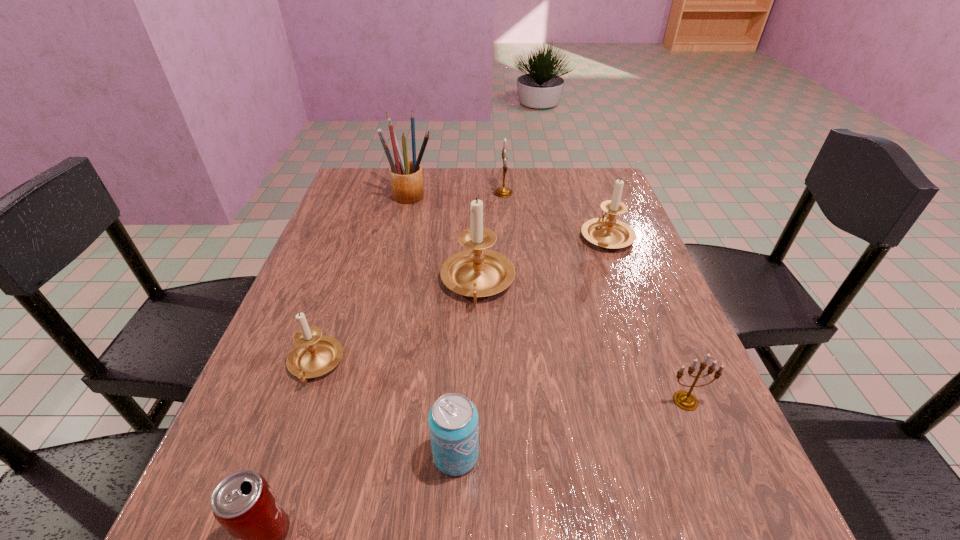
Where is `free space located on the left of the nearer gold candelabrum`? The height and width of the screenshot is (540, 960). free space located on the left of the nearer gold candelabrum is located at coordinates (479, 401).

Where is `vacant space located 0.100m on the right of the farther beer can`? vacant space located 0.100m on the right of the farther beer can is located at coordinates (543, 455).

This screenshot has width=960, height=540. I want to click on pencil box that is at the far edge, so click(x=406, y=177).

Where is `candelabrum positioned at the far edge`? candelabrum positioned at the far edge is located at coordinates (503, 192).

You are a GUI agent. You are given a task and a screenshot of the screen. Output one action in this format:
    pyautogui.click(x=<x>, y=<y>)
    Task: Click on the pencil box present at the left edge
    
    Given the screenshot: What is the action you would take?
    pyautogui.click(x=406, y=177)

Where is `candle holder that is at the left edge`? Image resolution: width=960 pixels, height=540 pixels. candle holder that is at the left edge is located at coordinates [314, 355].

This screenshot has height=540, width=960. Identify the location of object present at the far left corner. [x=406, y=177].

At what (x,y) coordinates should I click in order to perform the action: click on free spot at the far edge of the desktop. Please return your answer as a coordinate pair (x, y). The height and width of the screenshot is (540, 960). Looking at the image, I should click on (550, 170).

You are a GUI agent. You are given a task and a screenshot of the screen. Output one action in this format:
    pyautogui.click(x=<x>, y=<y>)
    Task: Click on the free region at the left edge of the desktop
    The height and width of the screenshot is (540, 960).
    Given the screenshot: What is the action you would take?
    pyautogui.click(x=237, y=470)

In the image, there is a desktop. Where is `vacant space at the right edge`? vacant space at the right edge is located at coordinates (678, 358).